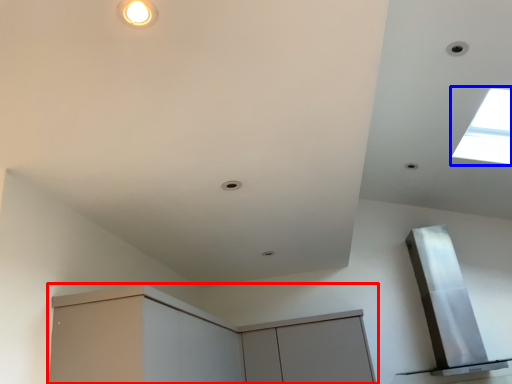
Question: Which object appears farthest to the camera in this image, cabinetry (highlighted by a red box) or window (highlighted by a blue box)?

Choices:
 (A) cabinetry
 (B) window

Answer: (B)